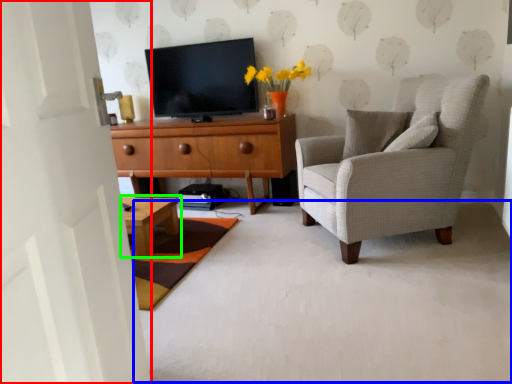
Question: Which object is the closest to the door (highlighted by a red box)? Choose among these: plain (highlighted by a blue box) or coffee table (highlighted by a green box).

Choices:
 (A) plain
 (B) coffee table

Answer: (A)